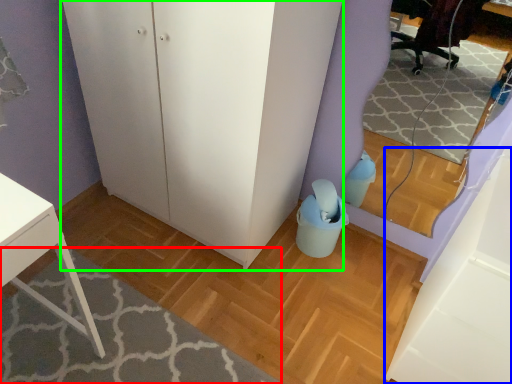
Question: Which object is the farthest from plain (highlighted by a red box)? Choose among these: cabinetry (highlighted by a blue box) or dresser (highlighted by a green box).

Choices:
 (A) cabinetry
 (B) dresser

Answer: (A)